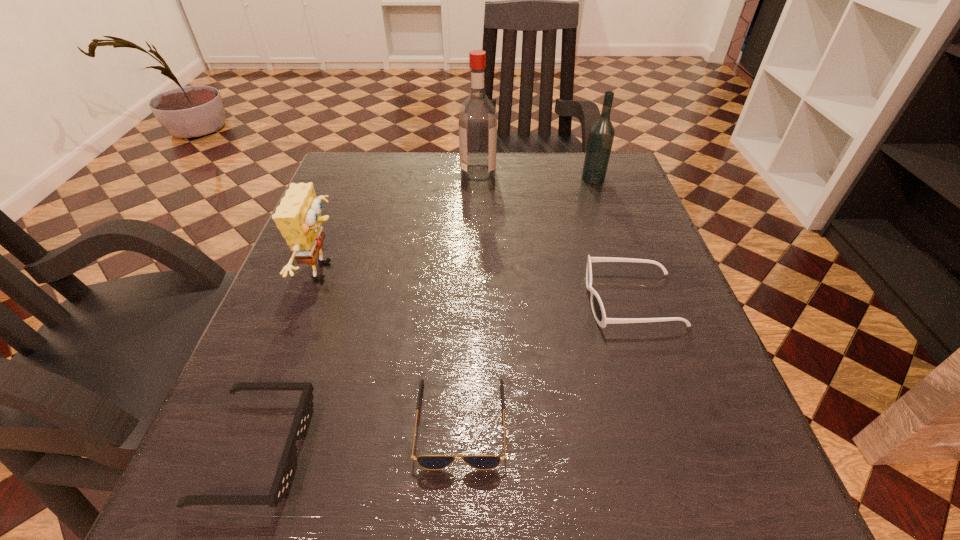
At what (x,y) coordinates should I click in order to perform the action: click on the tallest object. Please return your answer as a coordinate pair (x, y). Looking at the image, I should click on (477, 119).

Where is `the fifth shortest object`? the fifth shortest object is located at coordinates (601, 135).

Locate an element on the screen. This screenshot has width=960, height=540. sponge is located at coordinates (298, 217).

This screenshot has height=540, width=960. Find the location of `the rightmost sunglasses`. the rightmost sunglasses is located at coordinates (598, 310).

At what (x,y) coordinates should I click in order to perform the action: click on the fourth tallest object. Please return your answer as a coordinate pair (x, y). Looking at the image, I should click on (598, 310).

The image size is (960, 540). In order to click on the second sunglasses from left to right in this screenshot , I will do `click(430, 462)`.

Find the location of a particular element. the leftmost sunglasses is located at coordinates (285, 473).

In order to click on free point located 0.070m on the front-facing side of the tallest object in this screenshot , I will do `click(523, 173)`.

At what (x,y) coordinates should I click in order to perform the action: click on vacant space located 0.160m on the left of the vodka. Please return your answer as a coordinate pair (x, y). This screenshot has width=960, height=540. Looking at the image, I should click on (516, 178).

Locate an element on the screen. This screenshot has width=960, height=540. vacant space located 0.220m on the face of the fourth shortest object is located at coordinates (458, 271).